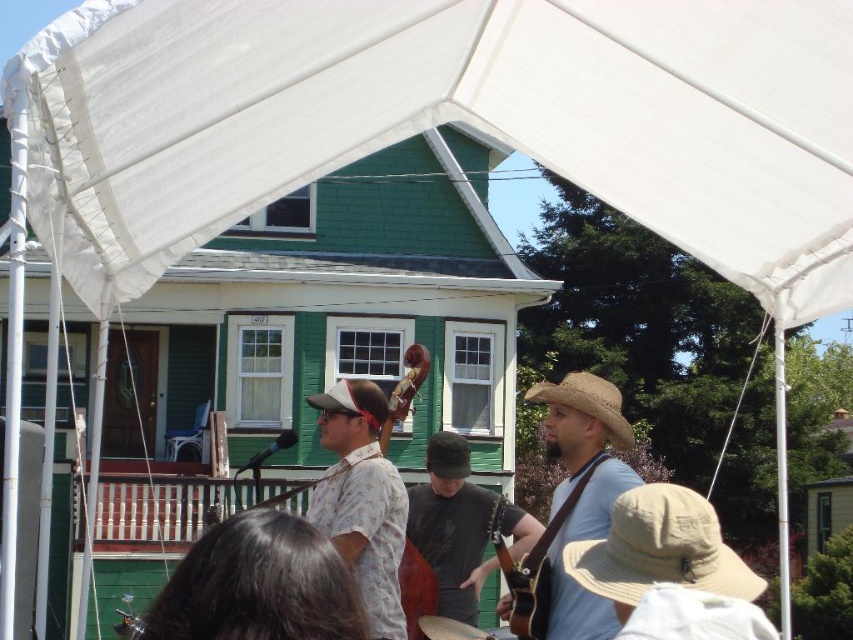
You are a photographer standing at the back of the tent and want to take a photo of the matte brown cello at center without the white fabric canopy at upper center blocking it. What should you do?

The white fabric canopy at upper center is in front of the matte brown cello at center, so to avoid blocking the cello, you should move your position to a lower angle or shift sideways to ensure the canopy is no longer between you and the cello.

You are standing at point A at the bottom left corner of the image. You want to walk to point B at the bottom right corner of the image. There is an obstacle at point C located at point (709, 35). What is the shortest path you can take to avoid the obstacle while reaching your destination?

The shortest path would involve moving around the obstacle at point C located at point (709, 35). Since the obstacle is 28.94 meters away from your current position, you can safely navigate around it by either going clockwise or counter clockwise, ensuring you maintain a safe distance while heading towards point B at the bottom right corner.